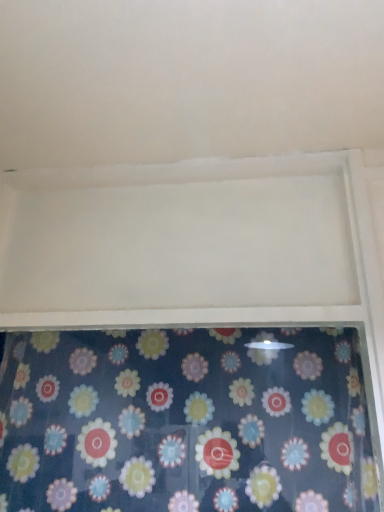
The image size is (384, 512). Describe the element at coordinates (184, 422) in the screenshot. I see `floral-patterned fabric at bottom` at that location.

Measure the distance between point (169,463) and camera.

Point (169,463) and camera are 3.33 feet apart.

Locate an element on the screen. This screenshot has height=512, width=384. floral-patterned fabric at bottom is located at coordinates (184, 422).

Locate an element on the screen. This screenshot has width=384, height=512. floral-patterned fabric at bottom is located at coordinates (184, 422).